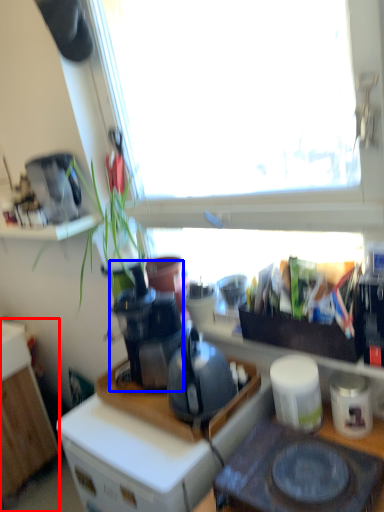
Question: Which of the following is the farthest to the observer, cabinetry (highlighted by a red box) or coffee machine (highlighted by a blue box)?

Choices:
 (A) cabinetry
 (B) coffee machine

Answer: (A)